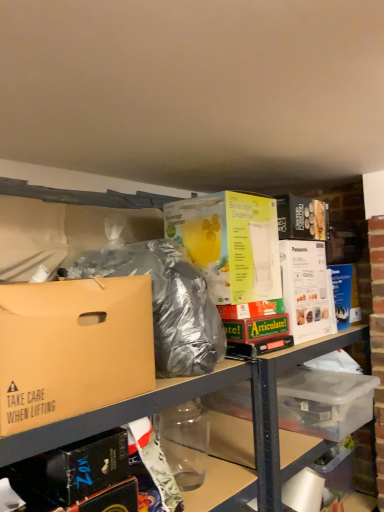
Question: Considering their positions, is yellow cardboard beverage dispenser at center, the 2th box from the front, located in front of or behind clear plastic storage box at lower right?

Choices:
 (A) front
 (B) behind

Answer: (A)

Question: Based on their sizes in the image, would you say yellow cardboard beverage dispenser at center, which is the first box from right to left, is bigger or smaller than clear plastic storage box at lower right?

Choices:
 (A) big
 (B) small

Answer: (B)

Question: Which of these objects is positioned closest to the clear plastic storage box at lower right?

Choices:
 (A) clear plastic bottle at lower center
 (B) brown cardboard box at left, the first box from the front
 (C) yellow cardboard beverage dispenser at center, the 2th box positioned from the left
 (D) clear plastic container at center
 (E) shiny metallic bag at center

Answer: (D)

Question: Based on their relative distances, which object is farther from the clear plastic container at center?

Choices:
 (A) shiny metallic bag at center
 (B) clear plastic storage box at lower right
 (C) brown cardboard box at left, the second box viewed from the back
 (D) yellow cardboard beverage dispenser at center, the 1th box when ordered from back to front
 (E) clear plastic bottle at lower center

Answer: (C)